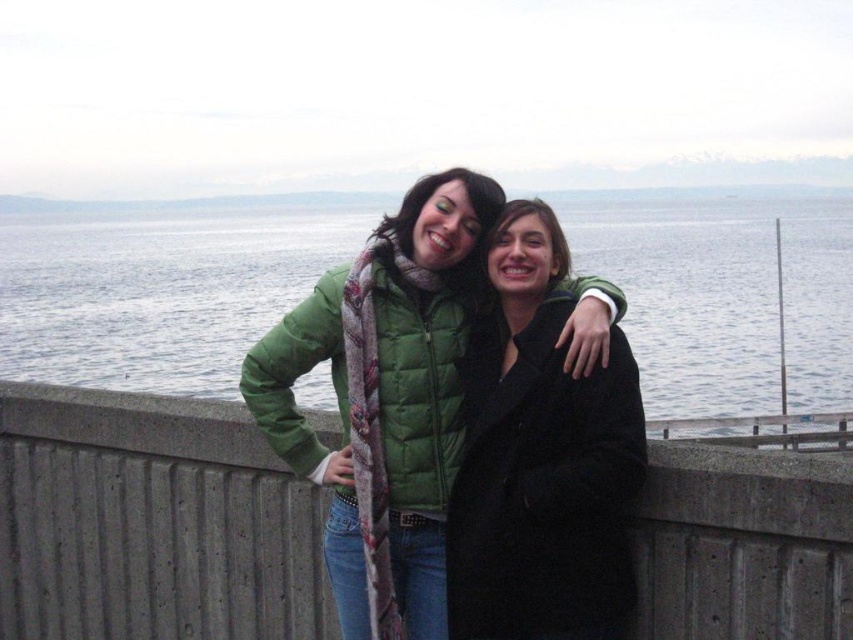
Question: Is concrete at center positioned behind black wool coat at center?

Choices:
 (A) yes
 (B) no

Answer: (B)

Question: Which of these objects is positioned farthest from the concrete at center?

Choices:
 (A) black wool coat at center
 (B) clear blue water at center

Answer: (B)

Question: Is clear blue water at center bigger than green puffer jacket at center?

Choices:
 (A) yes
 (B) no

Answer: (A)

Question: Is clear blue water at center positioned in front of green puffer jacket at center?

Choices:
 (A) yes
 (B) no

Answer: (B)

Question: Which object appears farthest from the camera in this image?

Choices:
 (A) clear blue water at center
 (B) green puffer jacket at center

Answer: (A)

Question: Among these objects, which one is farthest from the camera?

Choices:
 (A) concrete at center
 (B) clear blue water at center

Answer: (B)